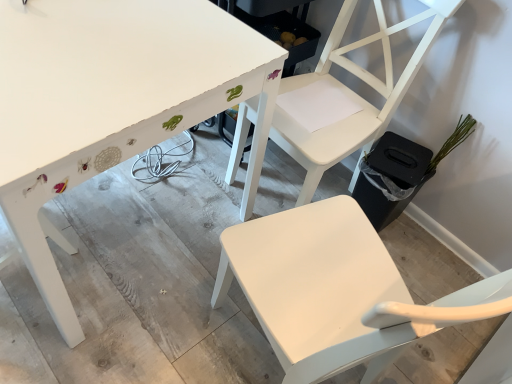
Identify the location of vacant region below white matte chair at upper right, the 2th chair when ordered from bottom to top (from a real-world perspective). The width and height of the screenshot is (512, 384). (294, 180).